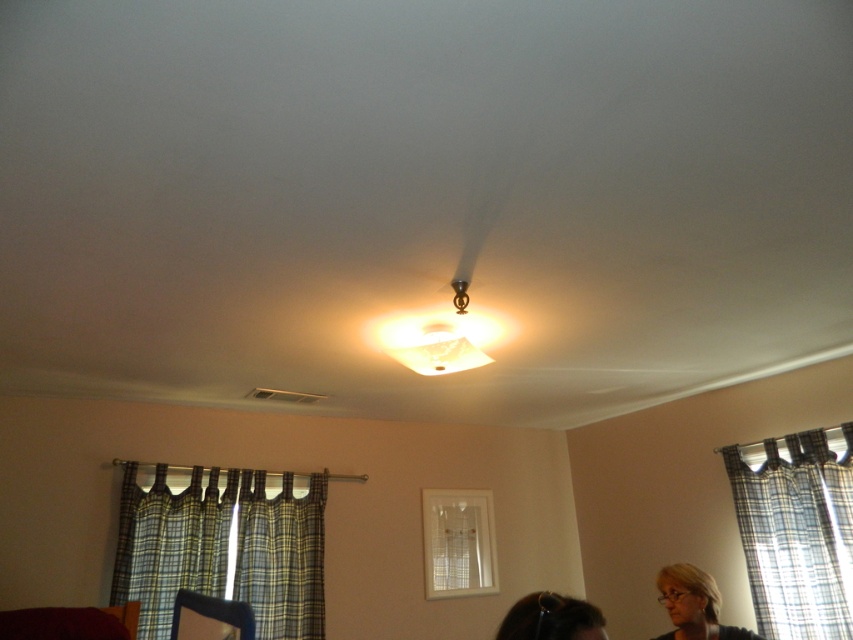
You are a guest in the room and want to see what is behind the plaid fabric curtain at lower right. Can you see the matte black hair at lower right from your current position?

The matte black hair at lower right is behind the plaid fabric curtain at lower right, so you cannot see it from your current position.

You are a stylist observing the two matte black hair at lower right and matte black hair at lower center in the image. Which one would you consider wider based on their spatial positioning?

The matte black hair at lower right might be wider than matte black hair at lower center according to the description.

You are standing in the room and want to determine which object is taller between the plaid fabric curtain at lower right and the matte black hair at lower right. Based on their positions, which one is taller?

The plaid fabric curtain at lower right is taller than the matte black hair at lower right according to the description.